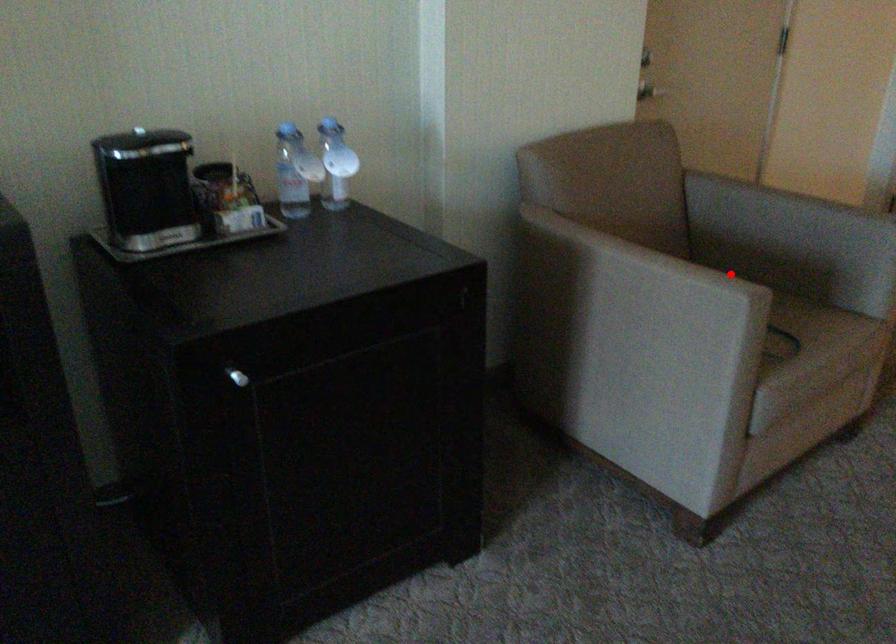
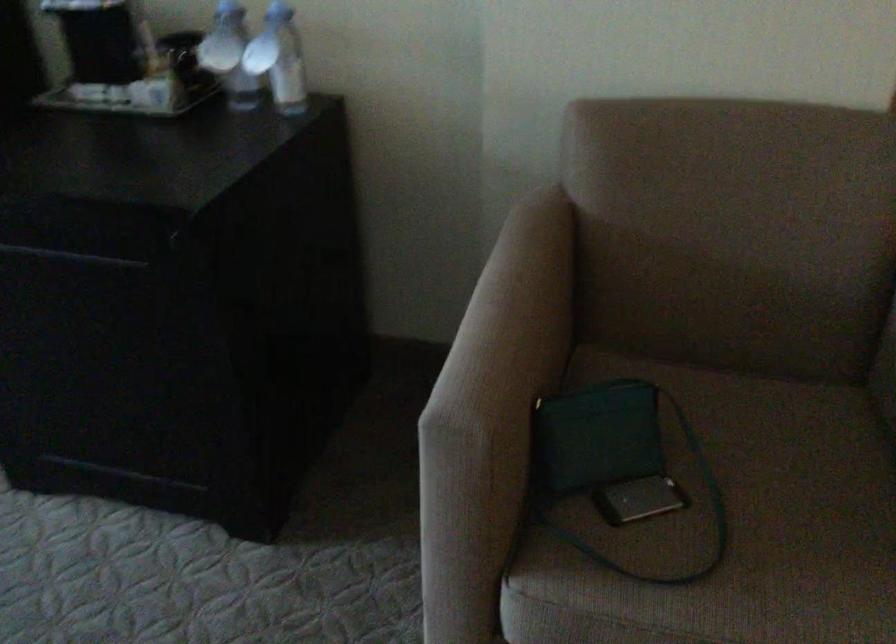
In the second image, find the point that corresponds to the highlighted location in the first image.

(495, 390)